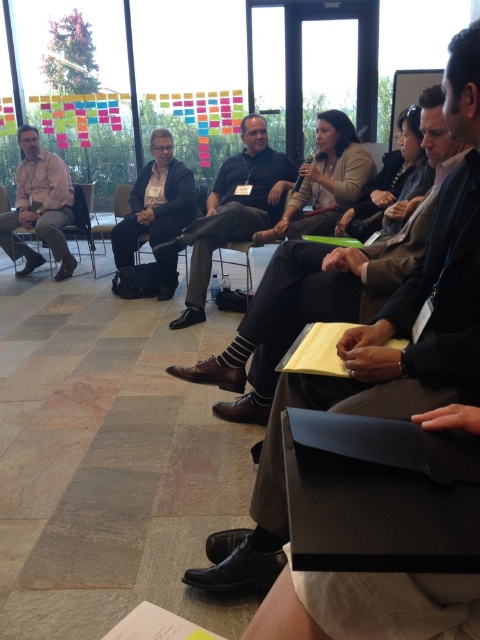
Question: Which point is closer to the camera?

Choices:
 (A) (241, 177)
 (B) (251, 385)

Answer: (B)

Question: Which object is closer to the camera taking this photo?

Choices:
 (A) dark brown leather shoes at center
 (B) dark gray suit at center
 (C) matte pink shirt at left

Answer: (A)

Question: Is dark brown leather shoes at center smaller than matte black suit at center?

Choices:
 (A) no
 (B) yes

Answer: (A)

Question: Can you confirm if dark gray suit at center is wider than matte black suit at center?

Choices:
 (A) yes
 (B) no

Answer: (A)

Question: Can you confirm if dark brown leather shoes at center is positioned above dark gray suit at center?

Choices:
 (A) no
 (B) yes

Answer: (A)

Question: Estimate the real-world distances between objects in this image. Which object is closer to the matte black suit at center?

Choices:
 (A) dark brown leather shoes at center
 (B) dark gray suit at center

Answer: (B)